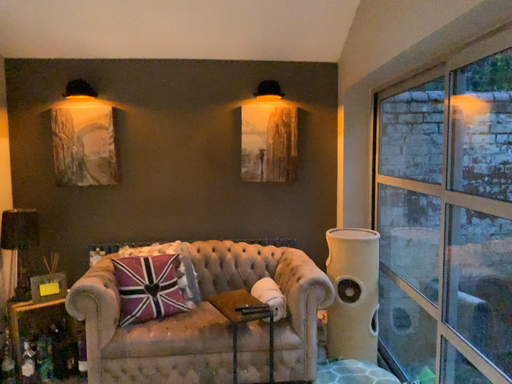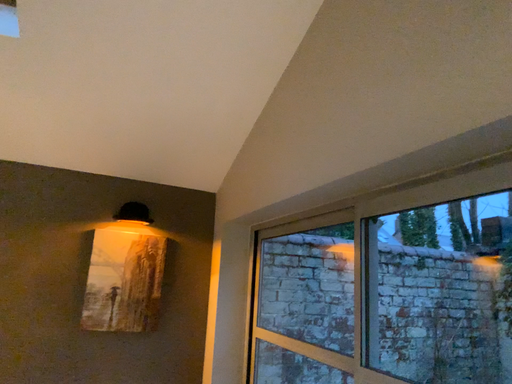
Question: How did the camera likely rotate when shooting the video?

Choices:
 (A) rotated left
 (B) rotated right

Answer: (B)